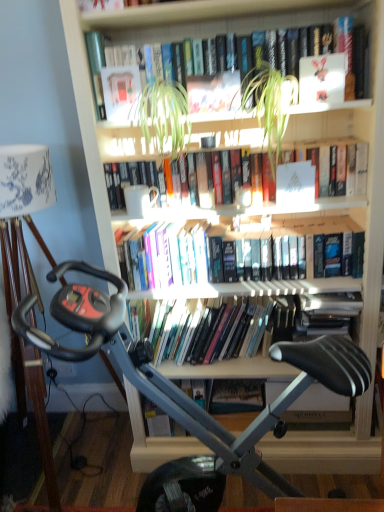
Question: From the image's perspective, is green leafy plant at upper center, positioned as the second plant in left-to-right order, above hardcover book at upper center, which is counted as the first book, starting from the top?

Choices:
 (A) no
 (B) yes

Answer: (A)

Question: Can you confirm if green leafy plant at upper center, arranged as the 1th plant when viewed from the right, is shorter than hardcover book at upper center, which is counted as the first book, starting from the top?

Choices:
 (A) no
 (B) yes

Answer: (A)

Question: Is green leafy plant at upper center, positioned as the second plant in left-to-right order, to the right of hardcover book at upper center, which is counted as the first book, starting from the top, from the viewer's perspective?

Choices:
 (A) no
 (B) yes

Answer: (B)

Question: Considering the relative sizes of green leafy plant at upper center, arranged as the 1th plant when viewed from the right, and hardcover book at upper center, the fourth book from the bottom, in the image provided, is green leafy plant at upper center, arranged as the 1th plant when viewed from the right, bigger than hardcover book at upper center, the fourth book from the bottom,?

Choices:
 (A) yes
 (B) no

Answer: (B)

Question: Is green leafy plant at upper center, positioned as the second plant in left-to-right order, oriented towards hardcover book at upper center, which is counted as the first book, starting from the top?

Choices:
 (A) no
 (B) yes

Answer: (A)

Question: Is hardcover books at center, acting as the 2th book starting from the top, to the left or to the right of matte paper book at upper center, arranged as the 3th paperback book when ordered from the bottom, in the image?

Choices:
 (A) left
 (B) right

Answer: (B)

Question: From a real-world perspective, is hardcover books at center, which is the 3th book from bottom to top, above or below matte paper book at upper center, the third paperback book when ordered from front to back?

Choices:
 (A) below
 (B) above

Answer: (A)

Question: Is hardcover books at center, acting as the 2th book starting from the top, wider or thinner than matte paper book at upper center, acting as the second paperback book starting from the top?

Choices:
 (A) wide
 (B) thin

Answer: (A)

Question: In the image, is hardcover books at center, which is the 3th book from bottom to top, positioned in front of or behind matte paper book at upper center, acting as the second paperback book starting from the top?

Choices:
 (A) front
 (B) behind

Answer: (B)

Question: From the image's perspective, is hardcover books at center, marked as the 3th book in a top-to-bottom arrangement, located above or below silver metallic stationary bicycle at center?

Choices:
 (A) below
 (B) above

Answer: (B)

Question: In the image, is hardcover books at center, marked as the 3th book in a top-to-bottom arrangement, on the left side or the right side of silver metallic stationary bicycle at center?

Choices:
 (A) right
 (B) left

Answer: (A)

Question: From their relative heights in the image, would you say hardcover books at center, the 2th book ordered from the bottom, is taller or shorter than silver metallic stationary bicycle at center?

Choices:
 (A) short
 (B) tall

Answer: (A)

Question: Is hardcover books at center, the 2th book ordered from the bottom, wider or thinner than silver metallic stationary bicycle at center?

Choices:
 (A) thin
 (B) wide

Answer: (A)

Question: Is white matte paper at center, which appears as the second paperback book when viewed from the right, bigger or smaller than green leafy plant at center, positioned as the first plant in left-to-right order?

Choices:
 (A) small
 (B) big

Answer: (A)

Question: Considering their positions, is white matte paper at center, marked as the third paperback book in a top-to-bottom arrangement, located in front of or behind green leafy plant at center, the 2th plant viewed from the right?

Choices:
 (A) behind
 (B) front

Answer: (A)